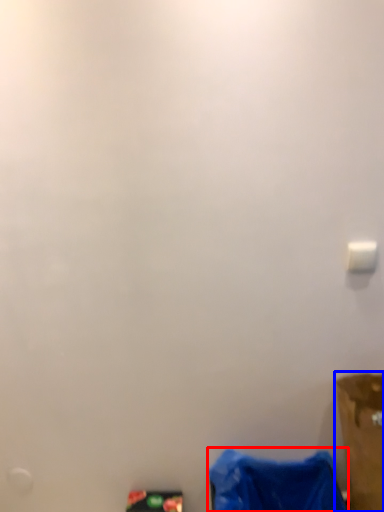
Question: Which object appears farthest to the camera in this image, waste (highlighted by a red box) or furniture (highlighted by a blue box)?

Choices:
 (A) waste
 (B) furniture

Answer: (A)